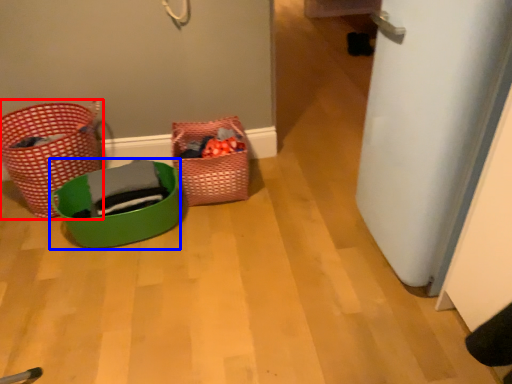
Question: Which object is further to the camera taking this photo, basket (highlighted by a red box) or basket (highlighted by a blue box)?

Choices:
 (A) basket
 (B) basket

Answer: (A)